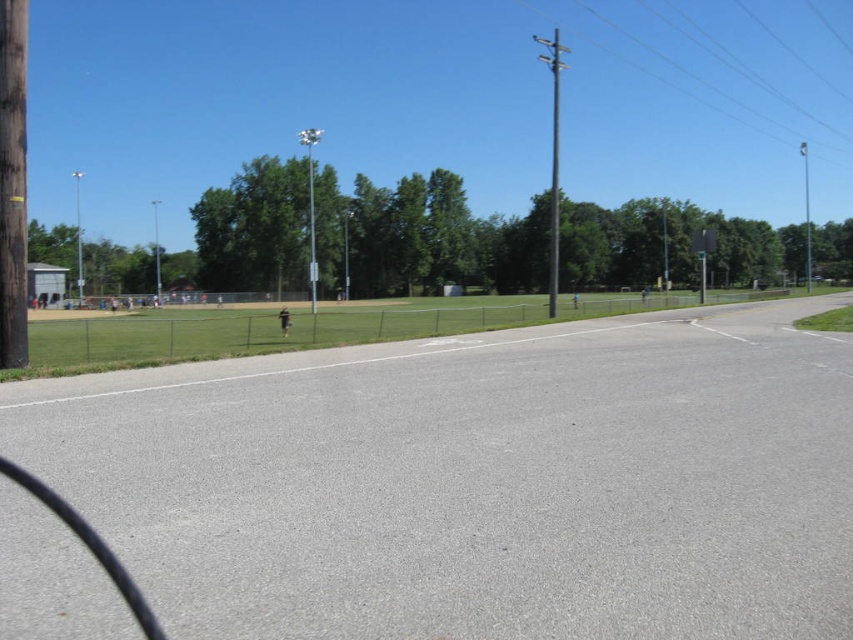
Is brown wooden telegraph pole at center to the left of smooth gray pole at center from the viewer's perspective?

Indeed, brown wooden telegraph pole at center is positioned on the left side of smooth gray pole at center.

Is brown wooden telegraph pole at center closer to camera compared to smooth gray pole at center?

Yes, it is in front of smooth gray pole at center.

You are a GUI agent. You are given a task and a screenshot of the screen. Output one action in this format:
    pyautogui.click(x=<x>, y=<y>)
    Task: Click on the brown wooden telegraph pole at center
    
    Given the screenshot: What is the action you would take?
    pyautogui.click(x=345, y=253)

Image resolution: width=853 pixels, height=640 pixels. Find the location of `brown wooden telegraph pole at center`. brown wooden telegraph pole at center is located at coordinates (345, 253).

What do you see at coordinates (553, 161) in the screenshot?
I see `metallic gray pole at center` at bounding box center [553, 161].

Is metallic gray pole at center closer to camera compared to smooth gray pole at center?

Yes, metallic gray pole at center is in front of smooth gray pole at center.

Which is in front, point (550, 232) or point (664, 269)?

Point (664, 269)

You are a GUI agent. You are given a task and a screenshot of the screen. Output one action in this format:
    pyautogui.click(x=<x>, y=<y>)
    Task: Click on the metallic gray pole at center
    The width and height of the screenshot is (853, 640).
    Given the screenshot: What is the action you would take?
    pyautogui.click(x=553, y=161)

Which of these two, brown wooden telegraph pole at left or smooth gray pole at center, stands taller?

brown wooden telegraph pole at left is taller.

Is point (155, 200) positioned after point (665, 282)?

Yes, it is behind point (665, 282).

Does point (154, 209) come in front of point (666, 218)?

That is False.

Locate an element on the screen. The width and height of the screenshot is (853, 640). brown wooden telegraph pole at left is located at coordinates (155, 252).